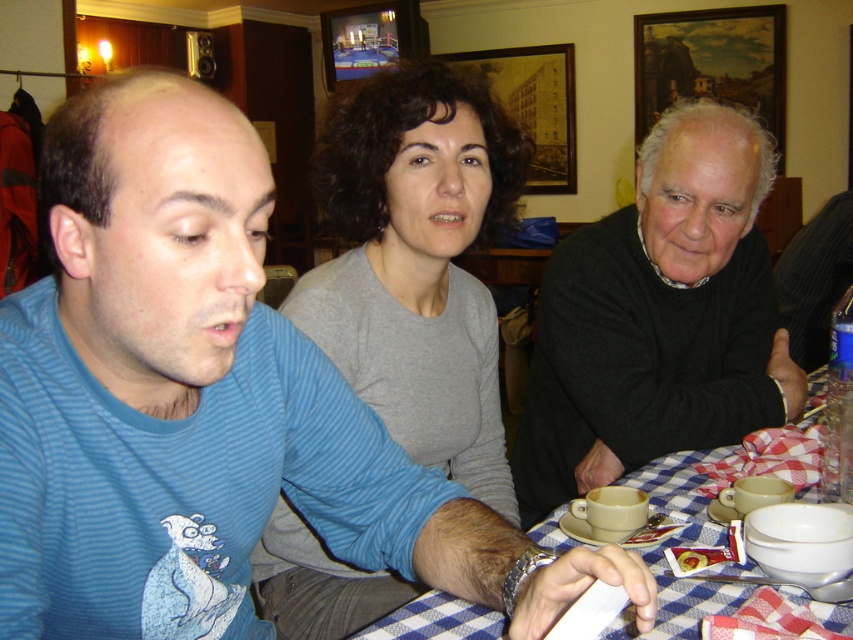
Question: From the image, what is the correct spatial relationship of gray matte shirt at center in relation to black wool sweater at right?

Choices:
 (A) below
 (B) above

Answer: (B)

Question: Among these points, which one is farthest from the camera?

Choices:
 (A) (368, 198)
 (B) (466, 637)

Answer: (A)

Question: Is blue striped shirt at left to the left of black wool sweater at right from the viewer's perspective?

Choices:
 (A) yes
 (B) no

Answer: (A)

Question: Among these objects, which one is nearest to the camera?

Choices:
 (A) blue striped shirt at left
 (B) black wool sweater at right

Answer: (A)

Question: Does gray matte shirt at center have a smaller size compared to blue checkered tablecloth at lower center?

Choices:
 (A) yes
 (B) no

Answer: (A)

Question: Which object is the farthest from the blue striped shirt at left?

Choices:
 (A) blue checkered tablecloth at lower center
 (B) black wool sweater at right
 (C) gray matte shirt at center

Answer: (B)